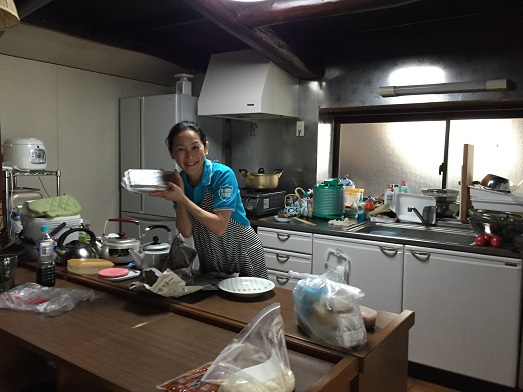
At what (x,y) coordinates should I click in order to perform the action: click on ceiling. Please return your answer as a coordinate pair (x, y). The width and height of the screenshot is (523, 392). Looking at the image, I should click on (147, 13).